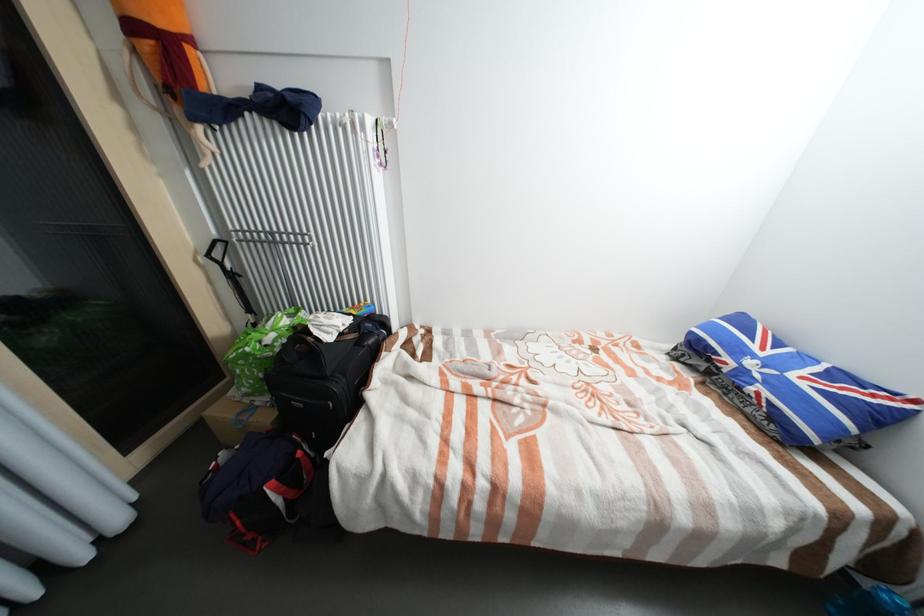
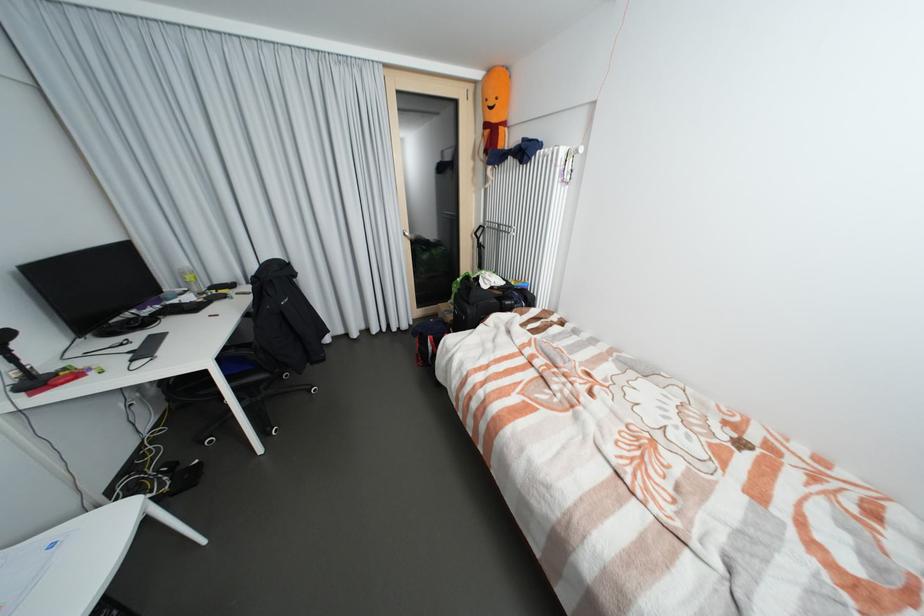
Locate, in the second image, the point that corresponds to (142,498) in the first image.

(418, 323)